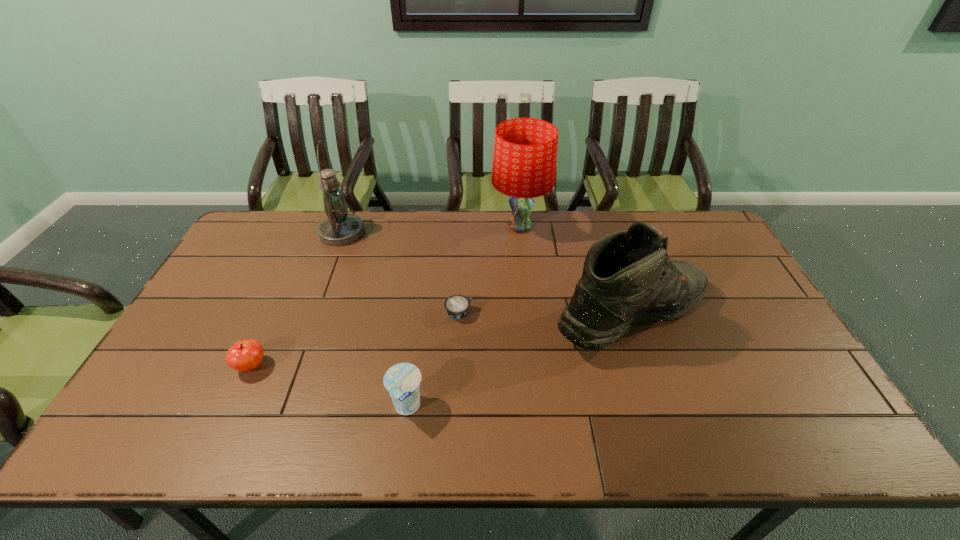
This screenshot has width=960, height=540. Identify the location of lampshade. (525, 149).

You are a GUI agent. You are given a task and a screenshot of the screen. Output one action in this format:
    pyautogui.click(x=<x>, y=<y>)
    Task: Click on the oil lamp
    The width and height of the screenshot is (960, 540).
    Given the screenshot: What is the action you would take?
    pyautogui.click(x=340, y=228)

The height and width of the screenshot is (540, 960). I want to click on ski boot, so click(x=628, y=276).

Identify the location of the left yogurt. (402, 381).

This screenshot has width=960, height=540. I want to click on the third shortest object, so (x=402, y=381).

In order to click on the fifth tallest object in this screenshot , I will do `click(245, 355)`.

This screenshot has width=960, height=540. I want to click on the farther yogurt, so click(457, 306).

Where is `the shorter yogurt`? The image size is (960, 540). the shorter yogurt is located at coordinates (457, 306).

Find the location of a particular element. Image resolution: width=960 pixels, height=540 pixels. vacant space located 0.220m on the front-facing side of the lampshade is located at coordinates (527, 291).

I want to click on vacant space located on the front of the oil lamp, so click(322, 288).